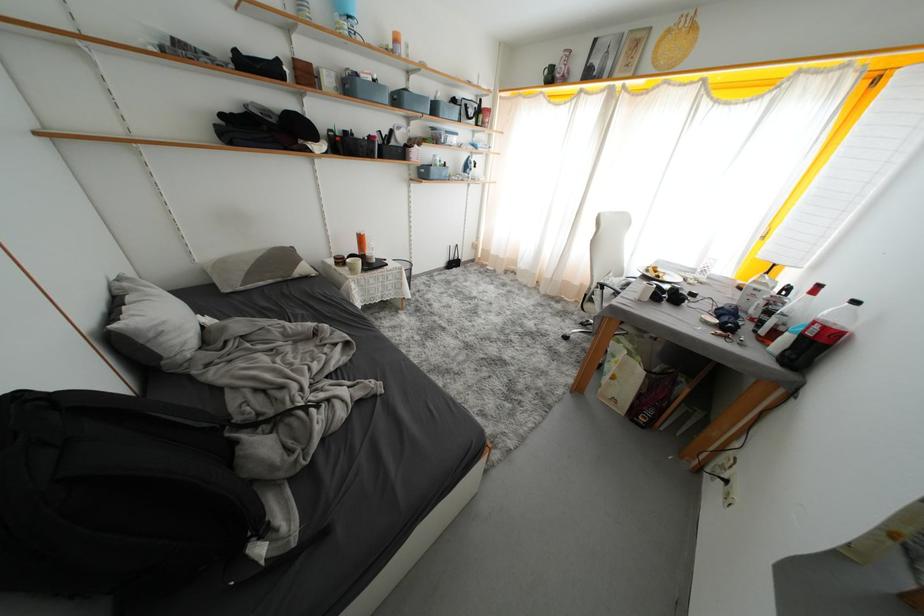
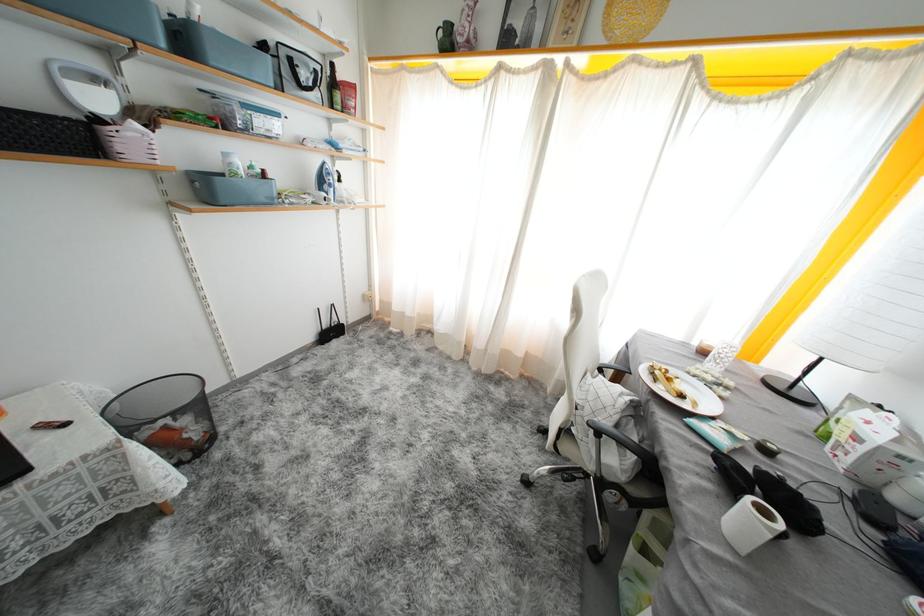
Question: Which direction would the cameraman need to move to produce the second image? Reply with the corresponding letter.

Choices:
 (A) Left
 (B) Right
 (C) Forward
 (D) Backward

Answer: (C)